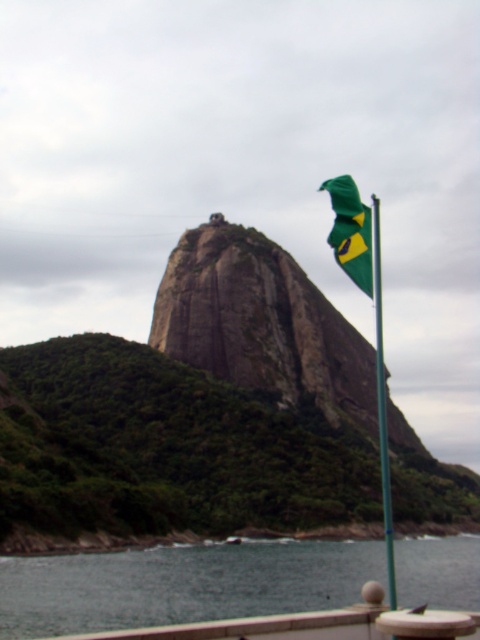
You are a photographer planning to capture the Brazilian flag and the rocky hill in your shot. Given the scene, which object, the smooth water at lower center or the green fabric flag at upper right, would occupy more horizontal space in the photo?

The smooth water at lower center would occupy more horizontal space in the photo since its width surpasses that of the green fabric flag at upper right.

You are standing at the base of the large, steep, rocky hill and see the point marked at coordinates (166, 448). Based on the scene, what type of terrain is this point located on?

The point marked at coordinates (166, 448) is on green rock at center, which is part of the large, steep, rocky hill described in the scene.

You are standing at the base of the green rock at center and want to reach the green fabric flag at right. Which direction should you move to get there?

The green rock at center is positioned on the left side of green fabric flag at right, so you should move to the right to reach the green fabric flag at right.